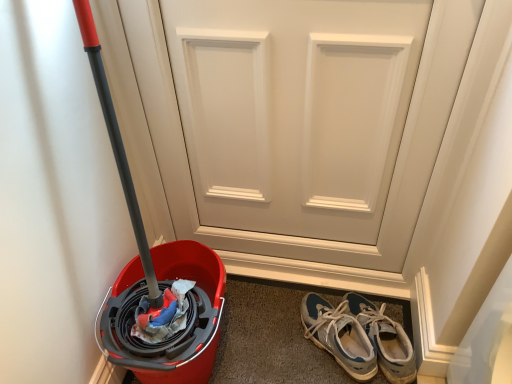
Question: From a real-world perspective, is white matte door at center located beneath blue suede sneakers at lower right, the 1th footwear positioned from the left?

Choices:
 (A) no
 (B) yes

Answer: (A)

Question: Considering the relative sizes of white matte door at center and blue suede sneakers at lower right, the 1th footwear positioned from the left, in the image provided, is white matte door at center wider than blue suede sneakers at lower right, the 1th footwear positioned from the left,?

Choices:
 (A) yes
 (B) no

Answer: (B)

Question: Does white matte door at center have a smaller size compared to blue suede sneakers at lower right, the 1th footwear positioned from the left?

Choices:
 (A) no
 (B) yes

Answer: (A)

Question: Is white matte door at center positioned before blue suede sneakers at lower right, the second footwear from the right?

Choices:
 (A) no
 (B) yes

Answer: (B)

Question: Could you tell me if white matte door at center is turned towards blue suede sneakers at lower right, the 1th footwear positioned from the left?

Choices:
 (A) yes
 (B) no

Answer: (A)

Question: Based on their sizes in the image, would you say white matte door at center is bigger or smaller than blue suede sneakers at lower right, the second footwear from the right?

Choices:
 (A) big
 (B) small

Answer: (A)

Question: Considering the positions of white matte door at center and blue suede sneakers at lower right, the 1th footwear positioned from the left, in the image, is white matte door at center wider or thinner than blue suede sneakers at lower right, the 1th footwear positioned from the left,?

Choices:
 (A) wide
 (B) thin

Answer: (B)

Question: Do you think white matte door at center is within blue suede sneakers at lower right, the 1th footwear positioned from the left, or outside of it?

Choices:
 (A) inside
 (B) outside

Answer: (B)

Question: Considering the positions of white matte door at center and blue suede sneakers at lower right, the 1th footwear positioned from the left, in the image, is white matte door at center taller or shorter than blue suede sneakers at lower right, the 1th footwear positioned from the left,?

Choices:
 (A) tall
 (B) short

Answer: (A)

Question: From their relative heights in the image, would you say white matte door at center is taller or shorter than blue suede sneakers at lower right, which is the 2th footwear in left-to-right order?

Choices:
 (A) tall
 (B) short

Answer: (A)

Question: From the image's perspective, is white matte door at center located above or below blue suede sneakers at lower right, the 1th footwear in the right-to-left sequence?

Choices:
 (A) above
 (B) below

Answer: (A)

Question: Based on their sizes in the image, would you say white matte door at center is bigger or smaller than blue suede sneakers at lower right, the 1th footwear in the right-to-left sequence?

Choices:
 (A) small
 (B) big

Answer: (B)

Question: Which is correct: white matte door at center is inside blue suede sneakers at lower right, the 1th footwear in the right-to-left sequence, or outside of it?

Choices:
 (A) inside
 (B) outside

Answer: (B)

Question: Is blue suede sneakers at lower right, the 1th footwear in the right-to-left sequence, wider or thinner than blue suede sneakers at lower right, the 1th footwear positioned from the left?

Choices:
 (A) wide
 (B) thin

Answer: (A)

Question: From the image's perspective, relative to blue suede sneakers at lower right, the second footwear from the right, is blue suede sneakers at lower right, the 1th footwear in the right-to-left sequence, above or below?

Choices:
 (A) below
 (B) above

Answer: (B)